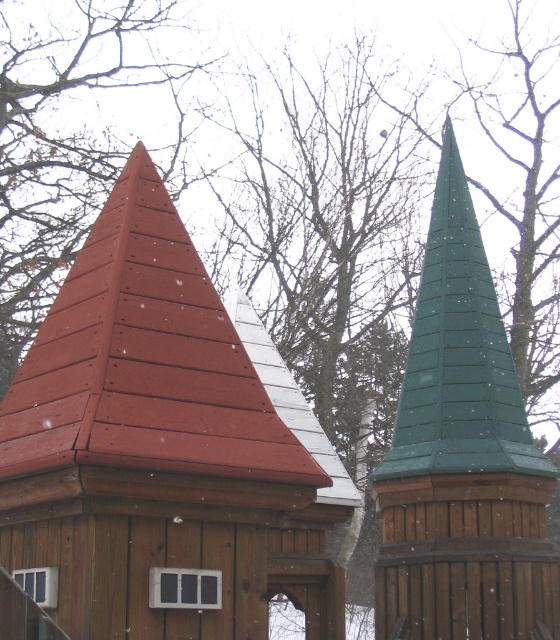
Question: Is matte red shingles at upper left below green wooden spire at right?

Choices:
 (A) yes
 (B) no

Answer: (A)

Question: Is matte red shingles at upper left above green wooden spire at right?

Choices:
 (A) no
 (B) yes

Answer: (A)

Question: Which point is farther from the camera taking this photo?

Choices:
 (A) (459, 628)
 (B) (332, 600)

Answer: (B)

Question: Is matte red shingles at upper left bigger than green wooden spire at right?

Choices:
 (A) yes
 (B) no

Answer: (B)